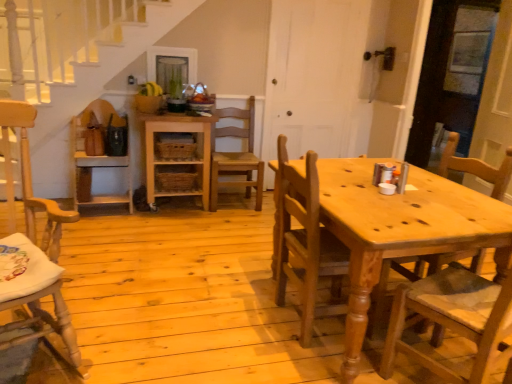
This screenshot has height=384, width=512. Identify the location of vacant area that lies between light brown wood chair at left, which is counted as the fourth chair, starting from the right, and natural wood shelf at center. (128, 261).